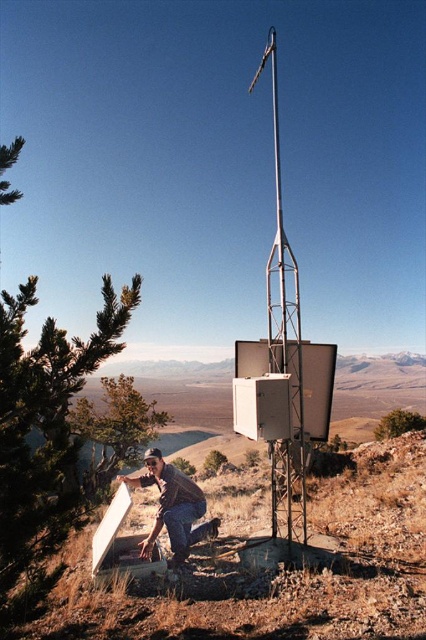
Which of these two, brown dirt at lower left or brown leather jacket at lower center, stands taller?

With more height is brown leather jacket at lower center.

Is point (305, 582) positioned behind point (161, 490)?

That is False.

Find the location of a particular element. brown dirt at lower left is located at coordinates (273, 566).

Can you confirm if brown dirt at lower left is wider than metallic pole at center?

No, brown dirt at lower left is not wider than metallic pole at center.

Which is above, brown dirt at lower left or metallic pole at center?

metallic pole at center

Where is `brown dirt at lower left`? The width and height of the screenshot is (426, 640). brown dirt at lower left is located at coordinates (273, 566).

Is metallic pole at center below brown leather jacket at lower center?

Incorrect, metallic pole at center is not positioned below brown leather jacket at lower center.

Who is lower down, metallic pole at center or brown leather jacket at lower center?

brown leather jacket at lower center is lower down.

This screenshot has width=426, height=640. In order to click on metallic pole at center in this screenshot , I will do `click(284, 348)`.